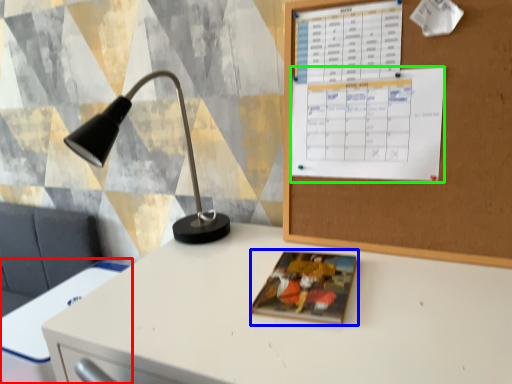
Question: Which object is the farthest from computer desk (highlighted by a red box)? Choose among these: book cover (highlighted by a blue box) or calendar (highlighted by a green box).

Choices:
 (A) book cover
 (B) calendar

Answer: (B)